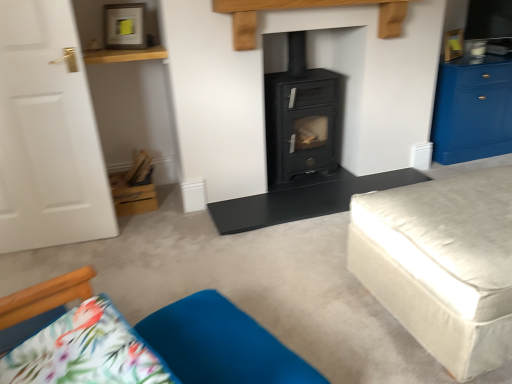
Where is `unoccupied area in front of white matte door at left`? Image resolution: width=512 pixels, height=384 pixels. unoccupied area in front of white matte door at left is located at coordinates (53, 264).